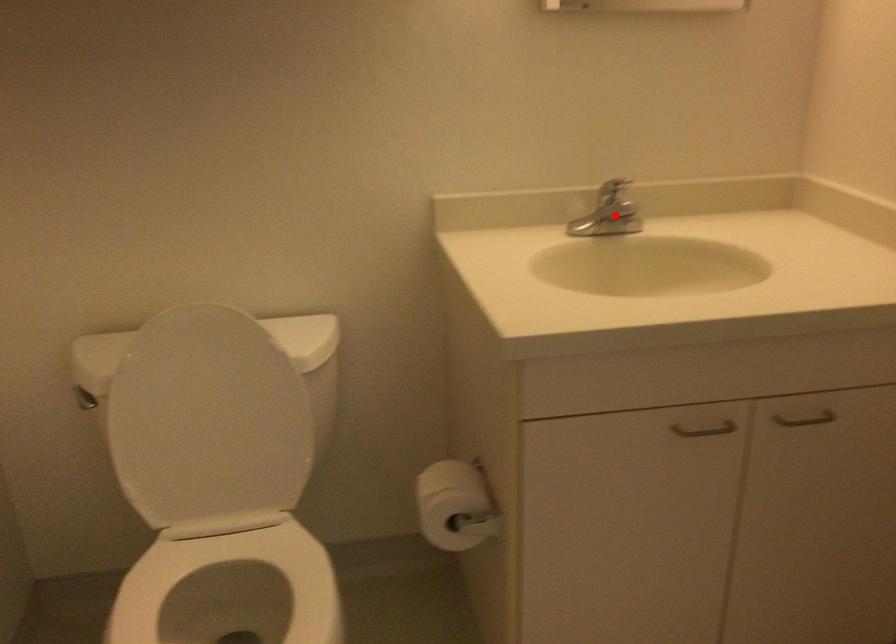
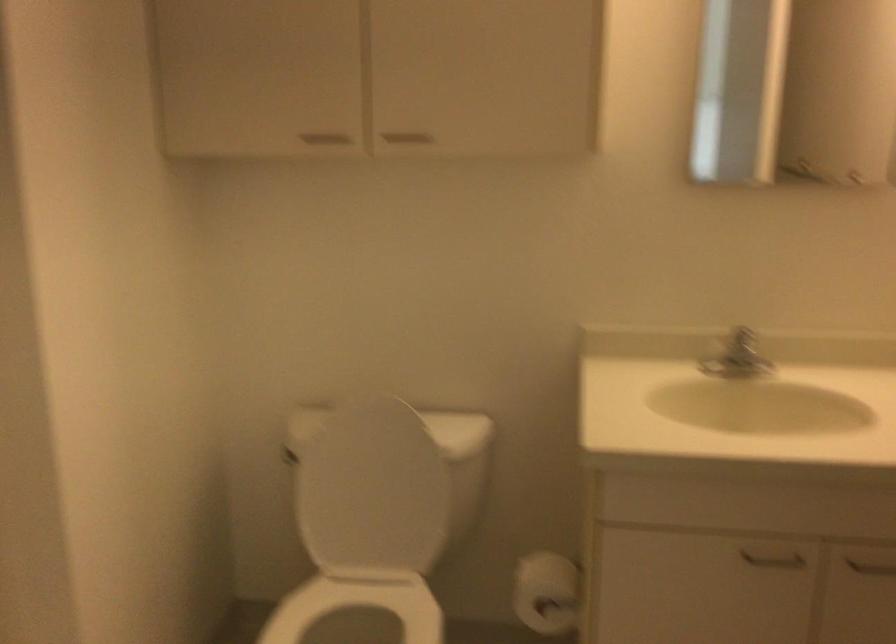
Question: I am providing you with two images of the same scene from different viewpoints. Given a red point in image1, look at the same physical point in image2. Is it:

Choices:
 (A) Closer to the viewpoint
 (B) Farther from the viewpoint

Answer: (B)